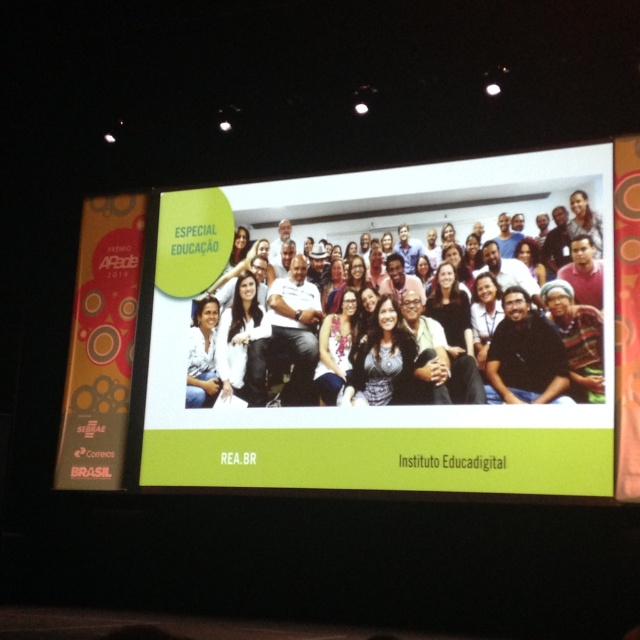
Between point (508, 406) and point (556, 172), which one is positioned behind?

Point (556, 172)

Can you confirm if white glossy projection screen at center is positioned below white fabric at center?

Correct, white glossy projection screen at center is located below white fabric at center.

Between point (621, 445) and point (198, 362), which one is positioned in front?

Positioned in front is point (621, 445).

Locate an element on the screen. white glossy projection screen at center is located at coordinates (349, 339).